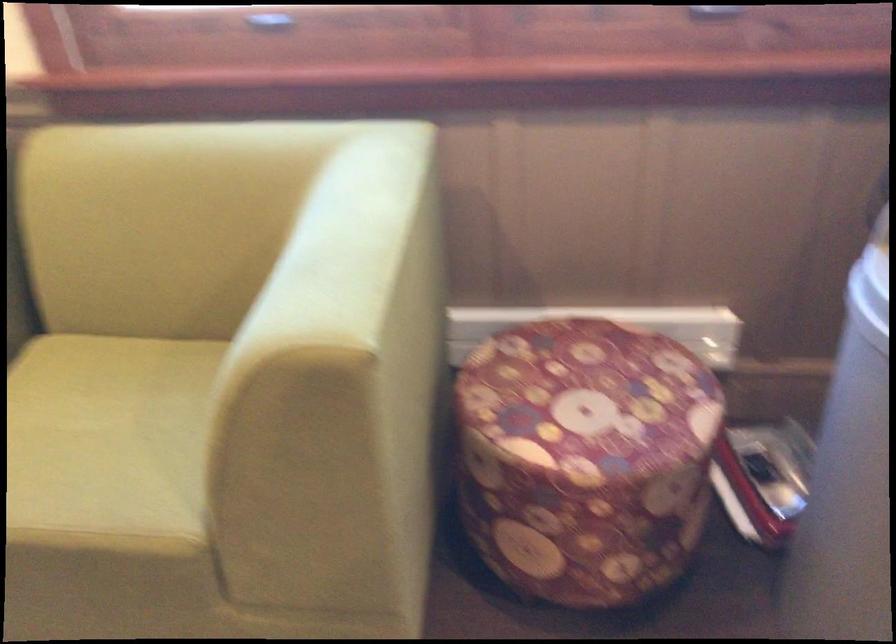
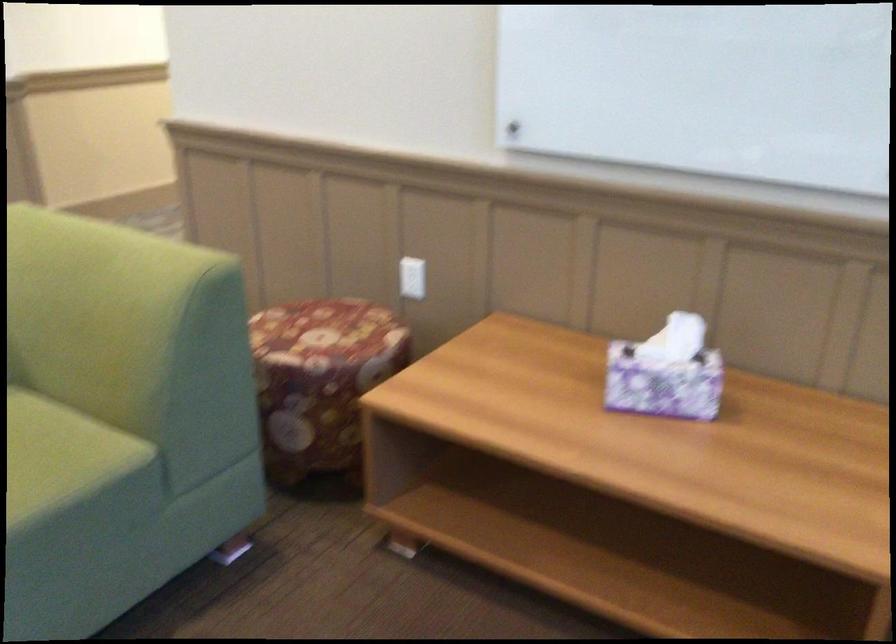
How did the camera likely rotate?

The rotation direction of the camera is left-down.